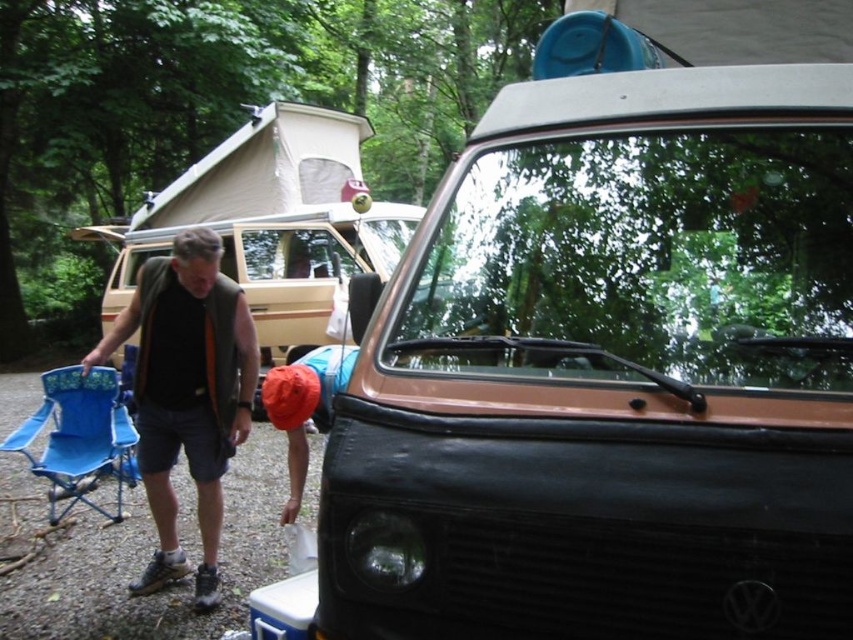
Question: Which object is closer to the camera taking this photo?

Choices:
 (A) matte black van at left
 (B) black fabric vest at left

Answer: (B)

Question: Can you confirm if black matte van at center is smaller than blue fabric folding chair at lower left?

Choices:
 (A) no
 (B) yes

Answer: (A)

Question: Does black matte van at center appear on the left side of matte black van at left?

Choices:
 (A) yes
 (B) no

Answer: (B)

Question: Is black fabric vest at left to the left of matte black van at left from the viewer's perspective?

Choices:
 (A) no
 (B) yes

Answer: (B)

Question: Which point is farther from the camera taking this photo?

Choices:
 (A) (x=463, y=387)
 (B) (x=258, y=252)
 (C) (x=120, y=417)

Answer: (B)

Question: Which of the following is the farthest from the observer?

Choices:
 (A) blue fabric folding chair at lower left
 (B) matte black van at left
 (C) black fabric vest at left
 (D) black matte van at center

Answer: (B)